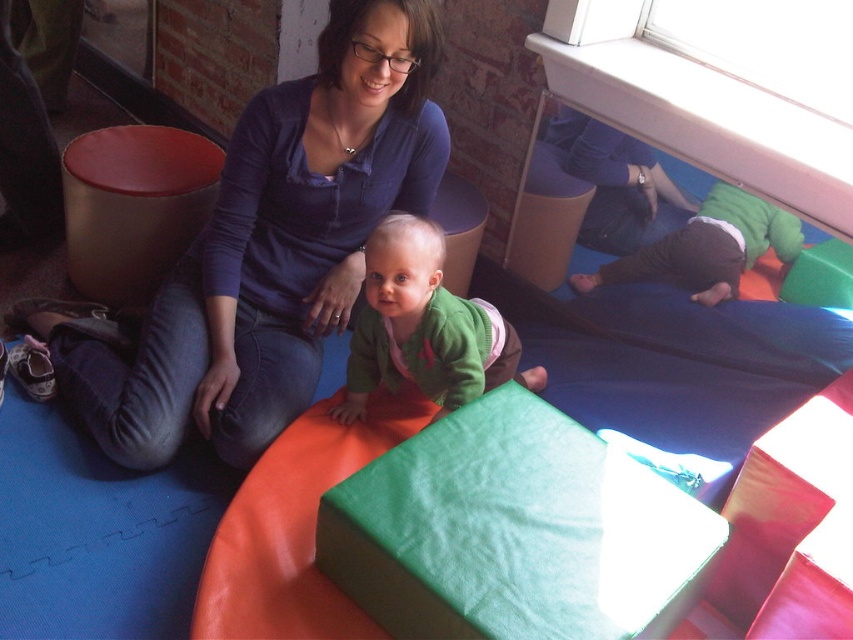
You are a parent looking for a sweater for your child. You see the green fleece sweater at center and the green fuzzy sweater at lower right. Which sweater is taller?

The green fleece sweater at center is taller than the green fuzzy sweater at lower right.

You are a photographer setting up for a family photo. You notice the matte blue shirt at upper center and the green fuzzy sweater at lower right in the frame. Which clothing item appears larger in the photo?

The matte blue shirt at upper center appears larger in the photo because it is taller than the green fuzzy sweater at lower right.